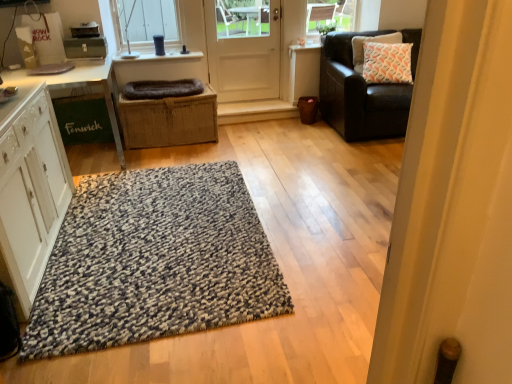
Question: Could you tell me if speckled wool rug at center is facing dark gray plush dog bed at center?

Choices:
 (A) yes
 (B) no

Answer: (B)

Question: Is speckled wool rug at center wider than dark gray plush dog bed at center?

Choices:
 (A) yes
 (B) no

Answer: (A)

Question: Does speckled wool rug at center lie behind dark gray plush dog bed at center?

Choices:
 (A) yes
 (B) no

Answer: (B)

Question: From the image's perspective, is speckled wool rug at center above dark gray plush dog bed at center?

Choices:
 (A) yes
 (B) no

Answer: (B)

Question: Does speckled wool rug at center appear on the right side of dark gray plush dog bed at center?

Choices:
 (A) no
 (B) yes

Answer: (B)

Question: From a real-world perspective, is speckled wool rug at center located beneath dark gray plush dog bed at center?

Choices:
 (A) no
 (B) yes

Answer: (B)

Question: Is speckled wool rug at center positioned with its back to clear glass window at upper center?

Choices:
 (A) no
 (B) yes

Answer: (A)

Question: Can we say speckled wool rug at center lies outside clear glass window at upper center?

Choices:
 (A) yes
 (B) no

Answer: (A)

Question: Is the depth of speckled wool rug at center greater than that of clear glass window at upper center?

Choices:
 (A) no
 (B) yes

Answer: (A)

Question: Does speckled wool rug at center have a smaller size compared to clear glass window at upper center?

Choices:
 (A) no
 (B) yes

Answer: (A)

Question: From a real-world perspective, is speckled wool rug at center located beneath clear glass window at upper center?

Choices:
 (A) no
 (B) yes

Answer: (B)

Question: Can you confirm if speckled wool rug at center is shorter than clear glass window at upper center?

Choices:
 (A) yes
 (B) no

Answer: (A)

Question: Is speckled wool rug at center located outside white matte door at center?

Choices:
 (A) no
 (B) yes

Answer: (B)